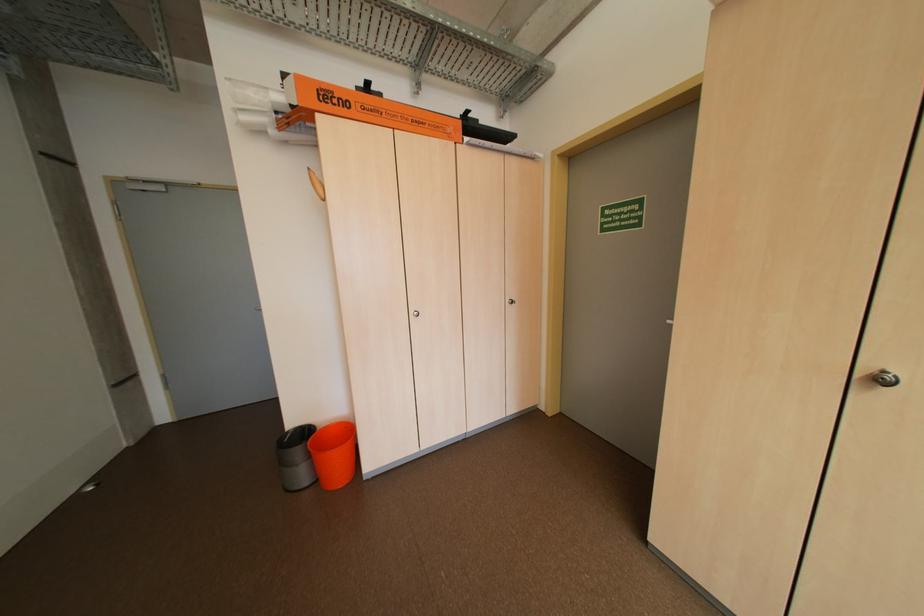
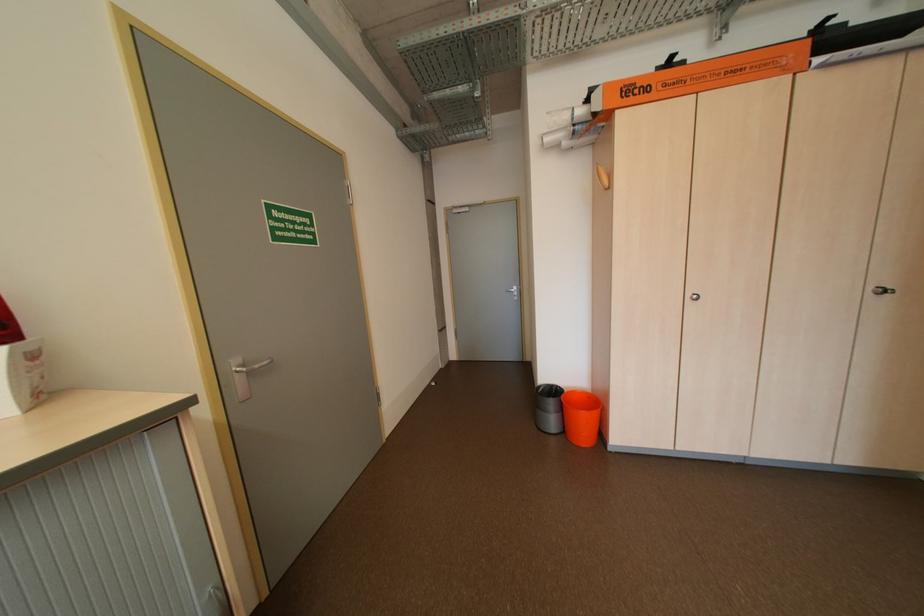
Locate, in the second image, the point that corresponds to point (335, 429) in the first image.

(582, 392)